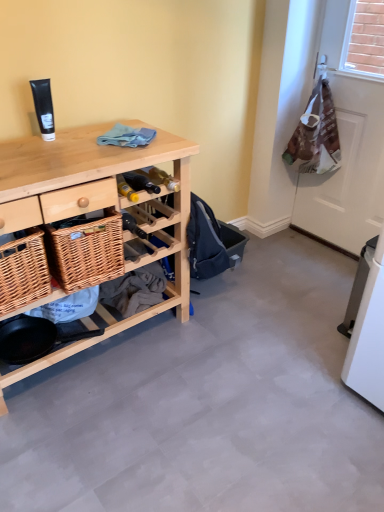
Locate an element on the screen. The image size is (384, 512). vacant region to the right of black matte tube at upper left is located at coordinates (94, 137).